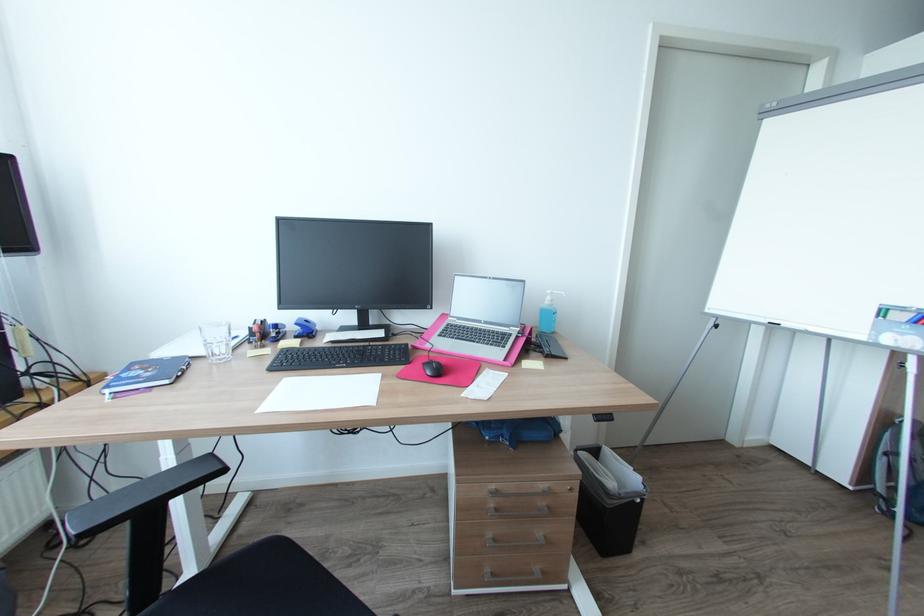
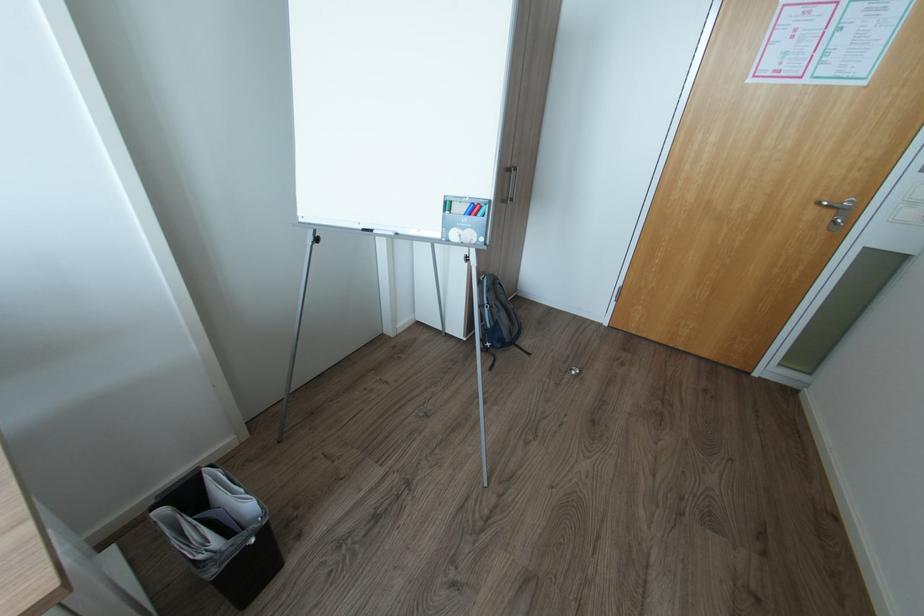
Where in the second image is the point corresponding to (715,323) from the first image?

(315, 238)